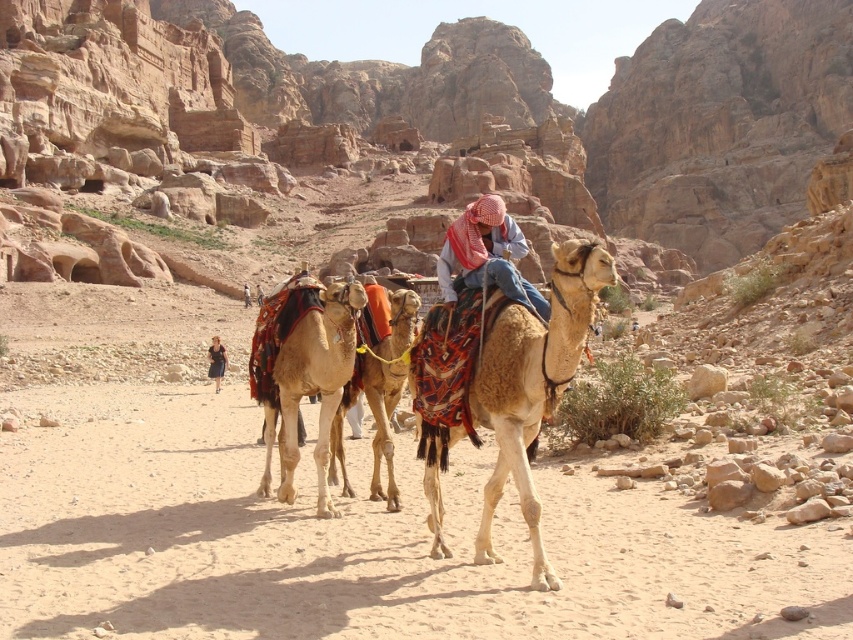
Question: Is dark blue dress at lower left positioned in front of dark blue dress at center?

Choices:
 (A) no
 (B) yes

Answer: (B)

Question: Which object is closer to the camera taking this photo?

Choices:
 (A) dark blue dress at center
 (B) brown leather jacket at center
 (C) light brown textured camel at center
 (D) reddish-brown fabric headscarf at center

Answer: (D)

Question: Observing the image, what is the correct spatial positioning of light brown textured camel at center in reference to brown leather jacket at center?

Choices:
 (A) above
 (B) below

Answer: (B)

Question: Which point is closer to the camera?

Choices:
 (A) reddish-brown fabric headscarf at center
 (B) dark blue dress at center
 (C) dark blue dress at lower left

Answer: (A)

Question: Which object appears closest to the camera in this image?

Choices:
 (A) brown leather jacket at center
 (B) dark blue dress at center

Answer: (A)

Question: Is reddish-brown fabric headscarf at center behind dark blue dress at lower left?

Choices:
 (A) no
 (B) yes

Answer: (A)